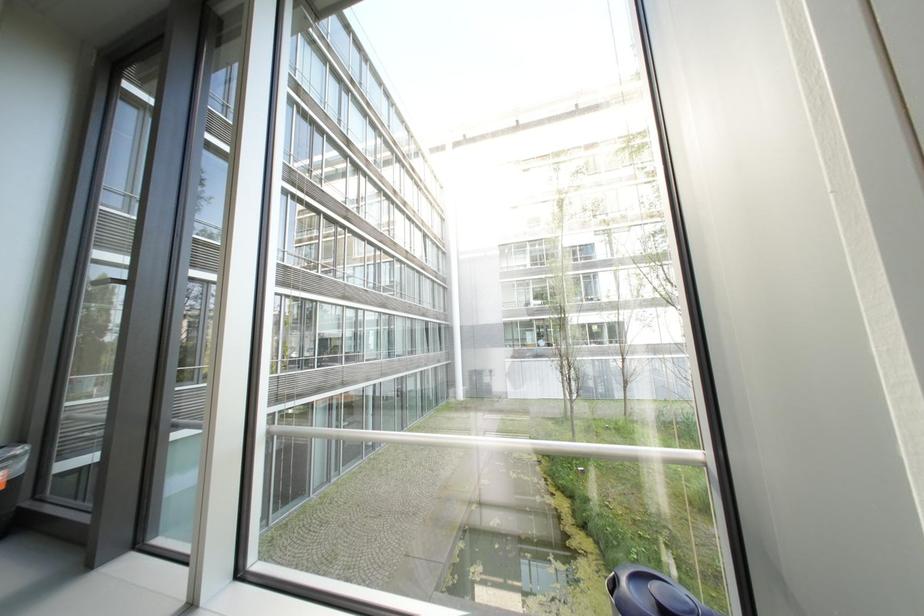
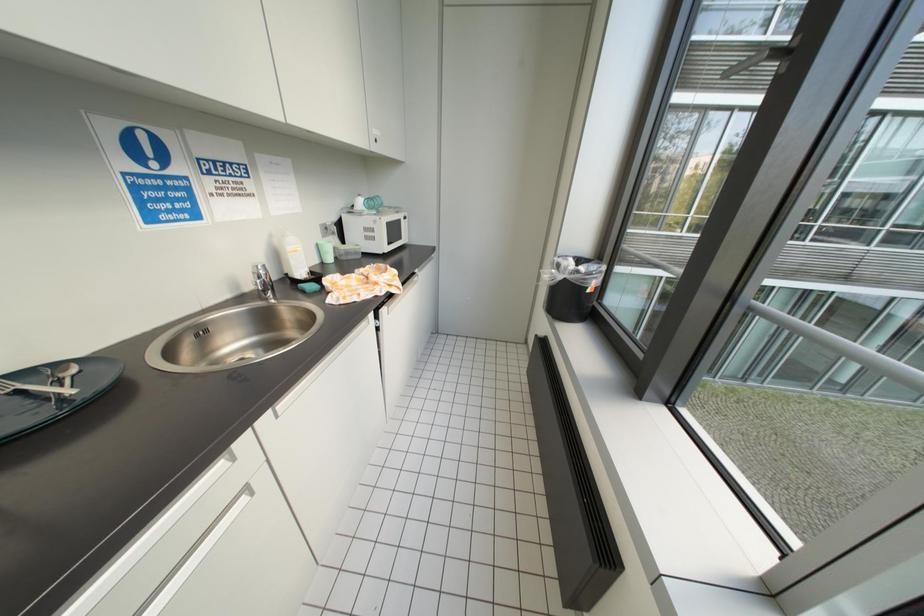
First-person continuous shooting, in which direction is the camera rotating?

The rotation direction of the camera is left-down.